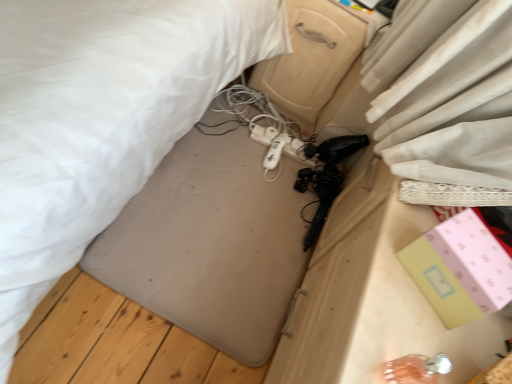
Locate an element on the screen. This screenshot has height=384, width=512. unoccupied space behind white plastic hairdryer at center is located at coordinates (285, 123).